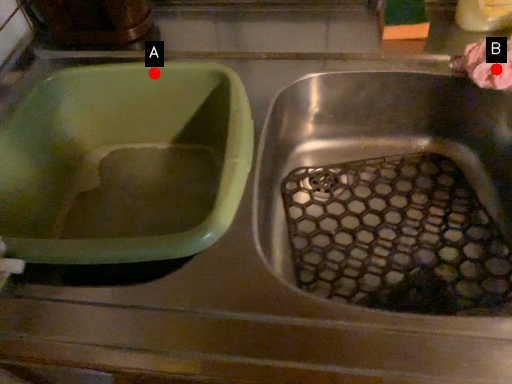
Question: Two points are circled on the image, labeled by A and B beside each circle. Which of the following is the farthest from the observer?

Choices:
 (A) A is further
 (B) B is further

Answer: (A)